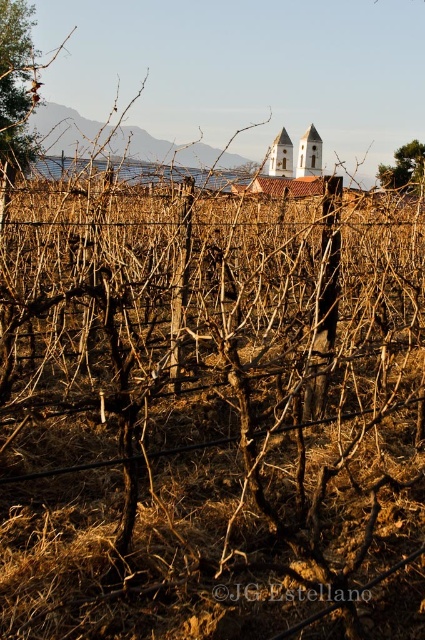
Is wire mesh at center behind white stucco chapel at center?

No, it is in front of white stucco chapel at center.

Can you confirm if wire mesh at center is positioned to the right of white stucco chapel at center?

No, wire mesh at center is not to the right of white stucco chapel at center.

Between point (413, 275) and point (311, 136), which one is positioned behind?

The point (311, 136) is more distant.

You are a GUI agent. You are given a task and a screenshot of the screen. Output one action in this format:
    pyautogui.click(x=<x>, y=<y>)
    Task: Click on the wire mesh at center
    Image resolution: width=425 pixels, height=640 pixels.
    Given the screenshot: What is the action you would take?
    pyautogui.click(x=204, y=406)

Between white stucco chapel at center and green leafy tree at upper right, which one has more height?

green leafy tree at upper right is taller.

Does point (272, 150) lie in front of point (407, 172)?

No.

At what (x,y) coordinates should I click in order to perform the action: click on white stucco chapel at center. Please return your answer as a coordinate pair (x, y). This screenshot has height=640, width=425. Looking at the image, I should click on (309, 154).

Who is more forward, (251, 193) or (278, 164)?

Result: Positioned in front is point (251, 193).

Does white stucco church at center appear under white stucco chapel at center?

Correct, white stucco church at center is located below white stucco chapel at center.

Measure the distance between point (333, 189) and camera.

Point (333, 189) is 3.19 meters away from camera.

Where is `white stucco church at center`? white stucco church at center is located at coordinates (291, 170).